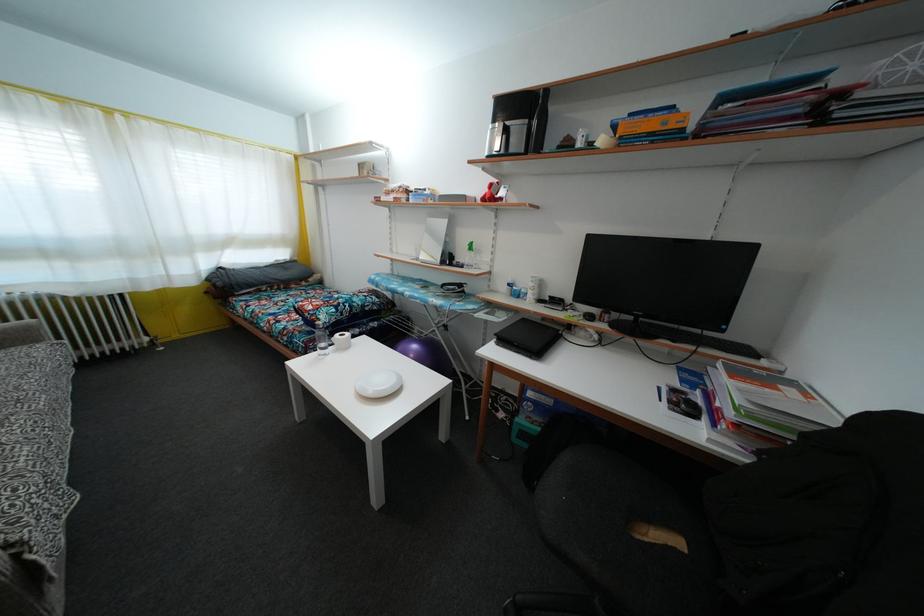
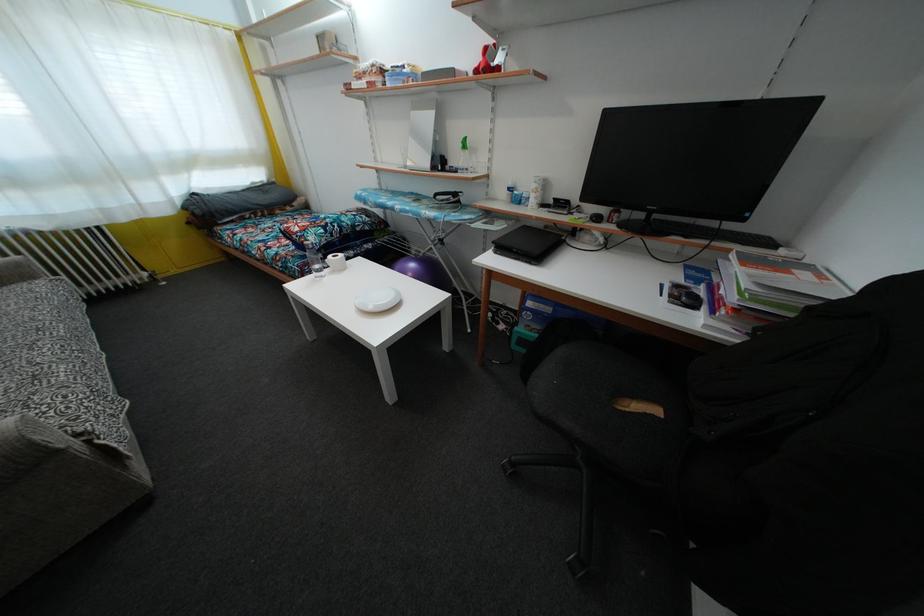
Locate, in the second image, the point that corresponds to [41,347] in the first image.

(38, 284)